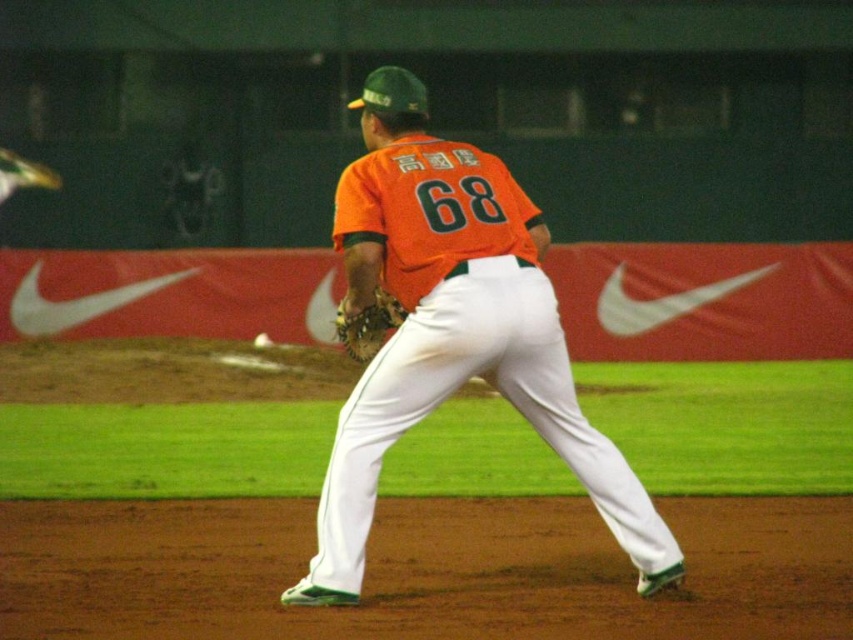
In the scene shown: You are a coach observing a baseball player wearing an orange matte jersey at center and holding a leather textured glove at center. Which item is wider when viewed from your perspective?

The orange matte jersey at center is wider than the leather textured glove at center.